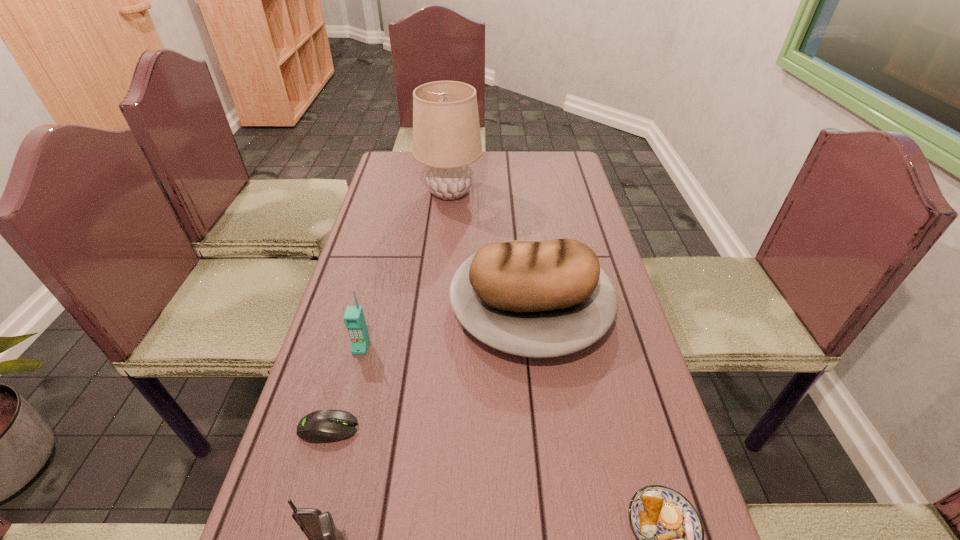
Where is `the tallest object`? This screenshot has width=960, height=540. the tallest object is located at coordinates (446, 132).

This screenshot has height=540, width=960. In order to click on lampshade in this screenshot , I will do `click(446, 132)`.

At what (x,y) coordinates should I click in order to perform the action: click on bread. Please return your answer as a coordinate pair (x, y). The height and width of the screenshot is (540, 960). Looking at the image, I should click on (540, 299).

This screenshot has height=540, width=960. What are the coordinates of `the farther cellular telephone` in the screenshot? It's located at (354, 319).

This screenshot has height=540, width=960. What are the coordinates of `the fourth farthest object` in the screenshot? It's located at (323, 426).

Find the location of a particular element. This screenshot has width=960, height=540. the shortest object is located at coordinates (323, 426).

Identify the location of free space located on the right of the farthest object. (554, 192).

This screenshot has height=540, width=960. Find the location of `free space located 0.260m on the back of the bread`. free space located 0.260m on the back of the bread is located at coordinates (519, 206).

Locate an element on the screen. Image resolution: width=960 pixels, height=540 pixels. vacant point located 0.350m on the keypad of the farther cellular telephone is located at coordinates (318, 519).

Find the location of a particular element. This screenshot has height=540, width=960. vacant point located on the wheel side of the shortest object is located at coordinates (449, 429).